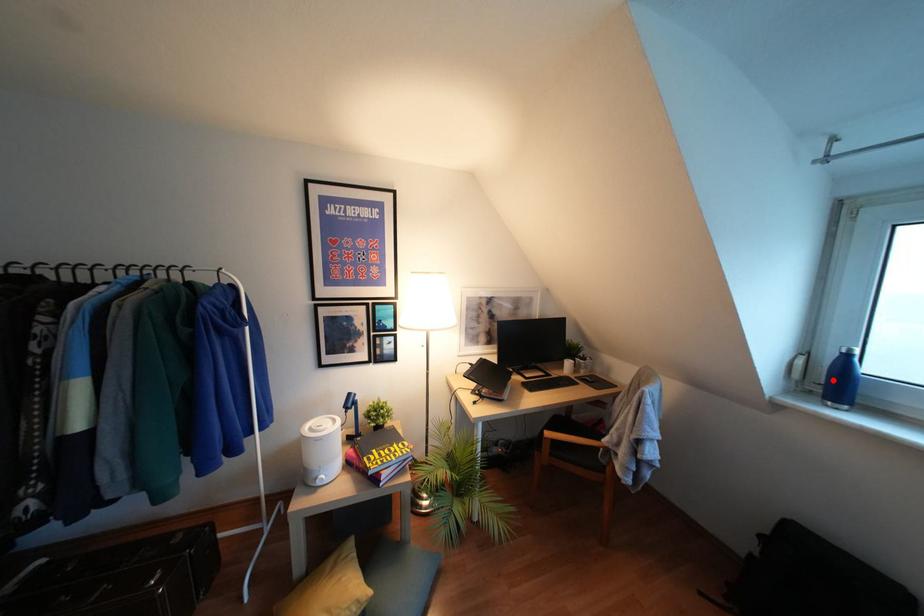
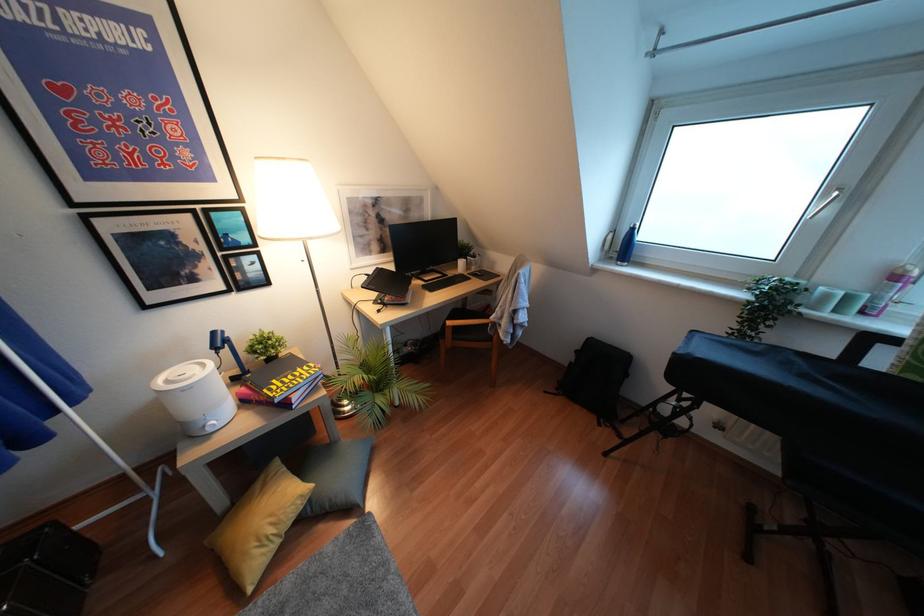
Where in the second image is the point corresponding to the highlighted location from the first image?

(623, 246)